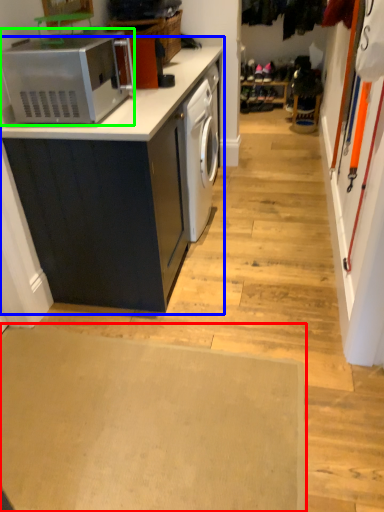
Question: Considering the real-world distances, which object is farthest from plain (highlighted by a red box)? cabinetry (highlighted by a blue box) or home appliance (highlighted by a green box)?

Choices:
 (A) cabinetry
 (B) home appliance

Answer: (B)